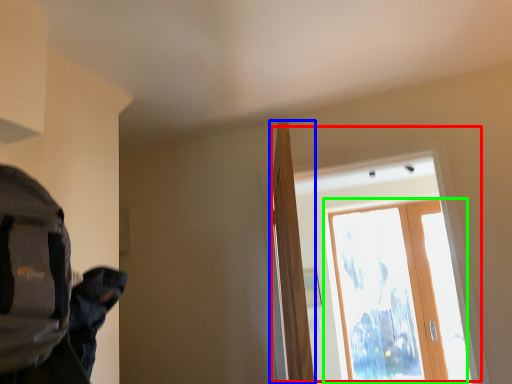
Question: Considering the real-world distances, which object is closest to window (highlighted by a red box)? door (highlighted by a blue box) or screen door (highlighted by a green box).

Choices:
 (A) door
 (B) screen door

Answer: (B)